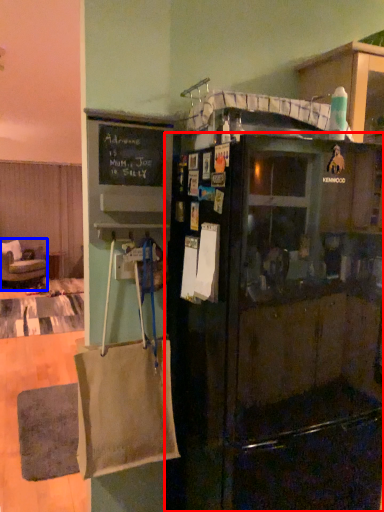
Question: Which point is closer to the camera, refrigerator (highlighted by a red box) or chair (highlighted by a blue box)?

Choices:
 (A) refrigerator
 (B) chair

Answer: (A)